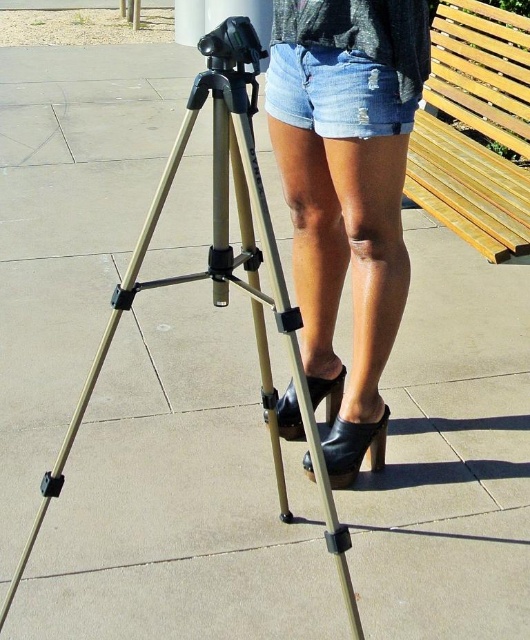
Question: Does denim shorts at center have a smaller size compared to metallic tripod at center?

Choices:
 (A) no
 (B) yes

Answer: (B)

Question: Which of these objects is positioned closest to the light brown wooden bench at upper right?

Choices:
 (A) metallic tripod at center
 (B) denim shorts at upper center

Answer: (B)

Question: Is denim shorts at center behind metallic tripod at center?

Choices:
 (A) no
 (B) yes

Answer: (B)

Question: Which point is closer to the camera?

Choices:
 (A) light brown wooden bench at upper right
 (B) denim shorts at center
 (C) metallic tripod at center

Answer: (C)

Question: Where is metallic tripod at center located in relation to light brown wooden bench at upper right in the image?

Choices:
 (A) right
 (B) left

Answer: (B)

Question: Which is nearer to the denim shorts at upper center?

Choices:
 (A) metallic tripod at center
 (B) denim shorts at center
 (C) light brown wooden bench at upper right

Answer: (B)